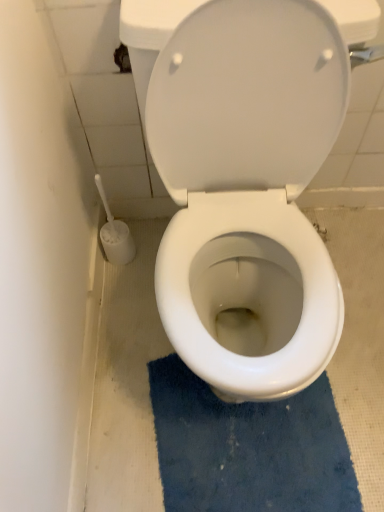
Question: Which is correct: white glossy toilet at center is inside blue textured bath mat at center, or outside of it?

Choices:
 (A) inside
 (B) outside

Answer: (B)

Question: Relative to blue textured bath mat at center, is white glossy toilet at center in front or behind?

Choices:
 (A) behind
 (B) front

Answer: (B)

Question: Is white glossy toilet at center to the left or to the right of blue textured bath mat at center in the image?

Choices:
 (A) left
 (B) right

Answer: (A)

Question: Considering the positions of point (198, 404) and point (200, 44), is point (198, 404) closer or farther from the camera than point (200, 44)?

Choices:
 (A) closer
 (B) farther

Answer: (B)

Question: From the image's perspective, is blue textured bath mat at center above or below white glossy toilet at center?

Choices:
 (A) below
 (B) above

Answer: (A)

Question: Which is correct: blue textured bath mat at center is inside white glossy toilet at center, or outside of it?

Choices:
 (A) outside
 (B) inside

Answer: (A)

Question: In terms of size, does blue textured bath mat at center appear bigger or smaller than white glossy toilet at center?

Choices:
 (A) big
 (B) small

Answer: (B)